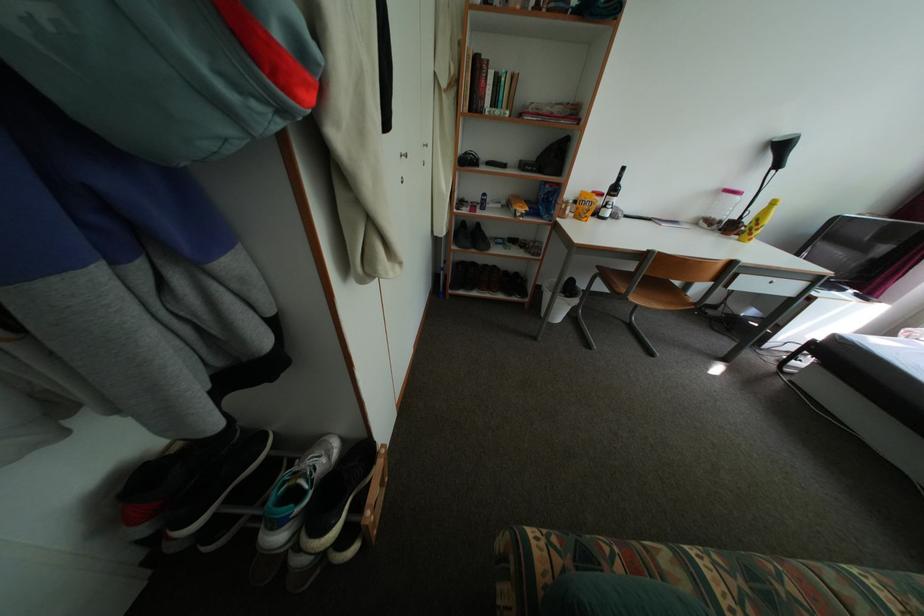
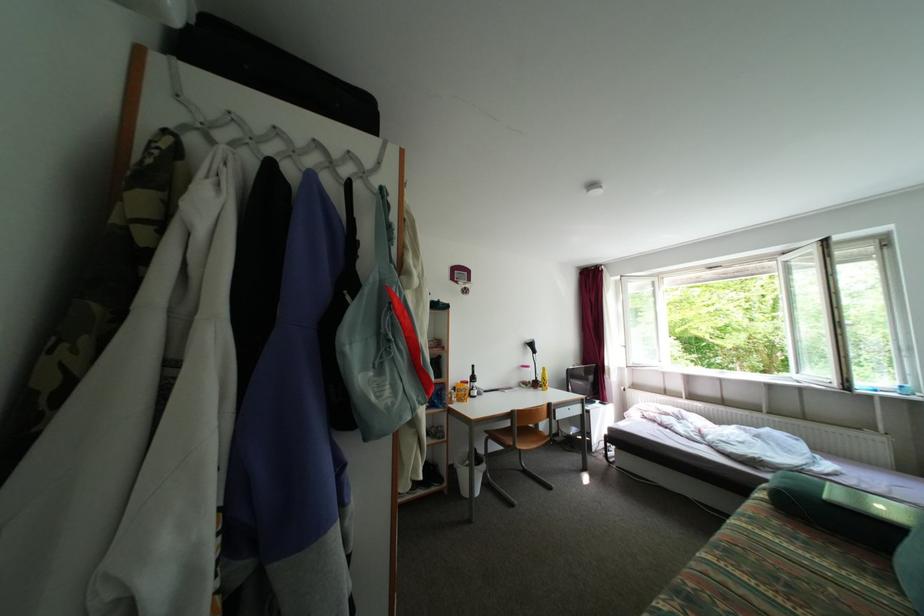
The first image is from the beginning of the video and the second image is from the end. How did the camera likely rotate when shooting the video?

The rotation direction of the camera is right-up.